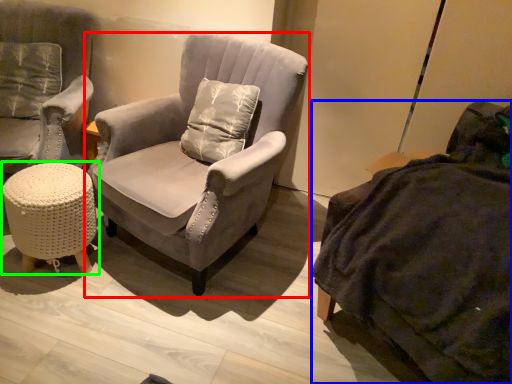
Question: Estimate the real-world distances between objects in this image. Which object is closer to chair (highlighted by a red box), studio couch (highlighted by a blue box) or table (highlighted by a green box)?

Choices:
 (A) studio couch
 (B) table

Answer: (B)